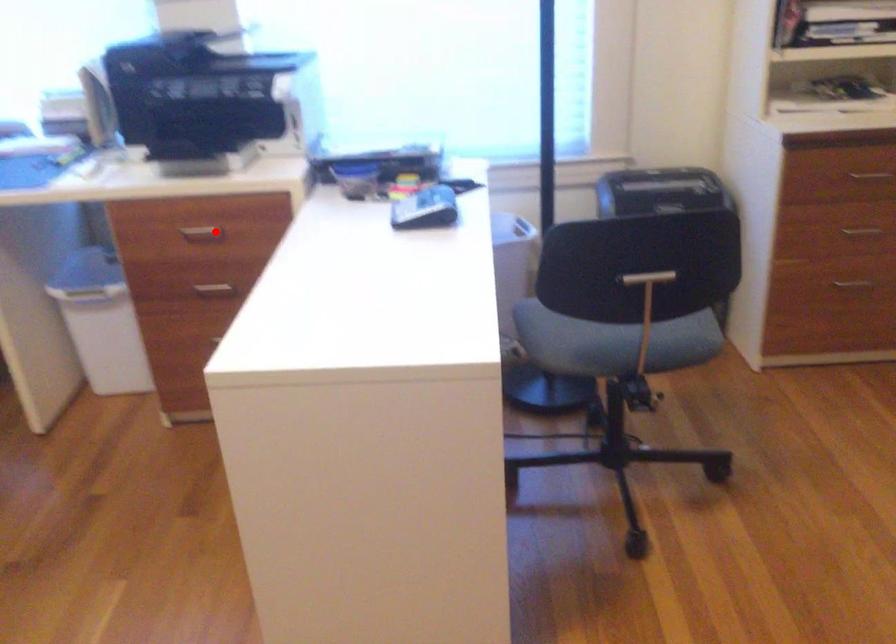
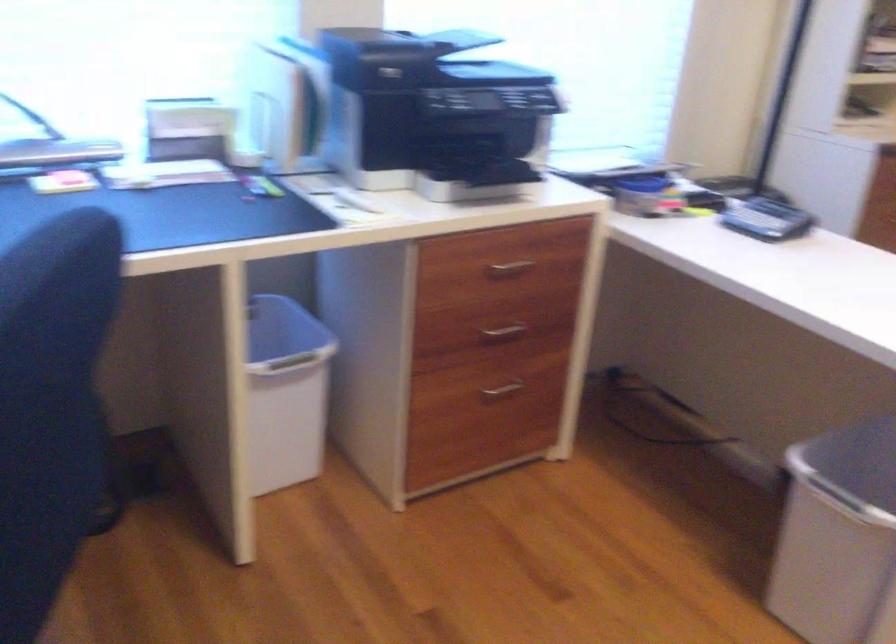
Question: I am providing you with two images of the same scene from different viewpoints. Image1 has a red point marked. In image2, the corresponding 3D location appears at what relative position? Reply with the corresponding letter.

Choices:
 (A) Closer
 (B) Farther

Answer: (A)